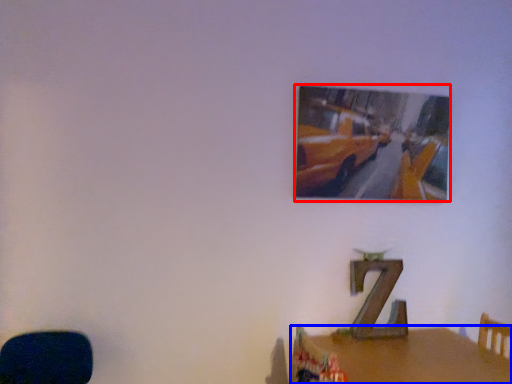
Question: Which point is closer to the camera, picture frame (highlighted by a red box) or table (highlighted by a blue box)?

Choices:
 (A) picture frame
 (B) table

Answer: (B)